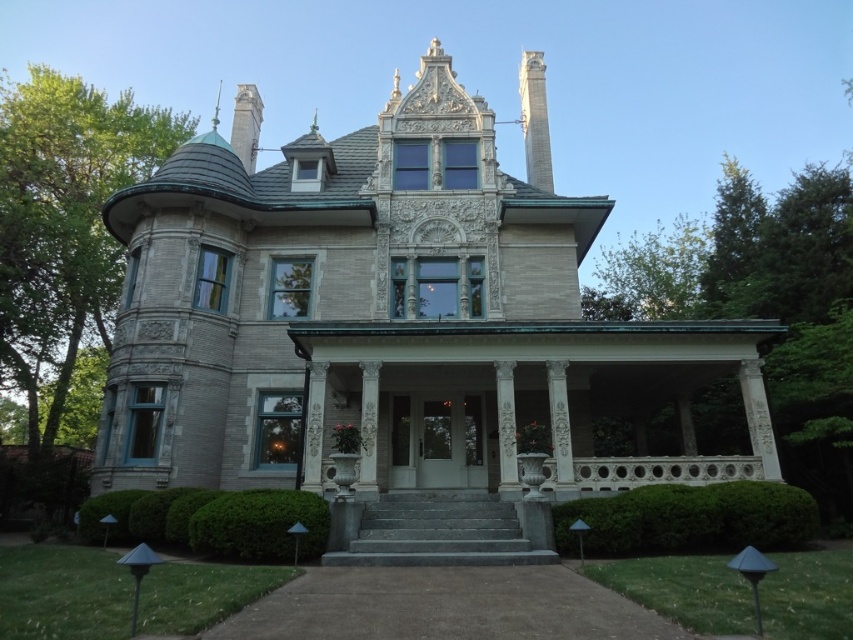
Question: Can you confirm if stone mansion at center is positioned to the right of gray stone steps at center?

Choices:
 (A) yes
 (B) no

Answer: (B)

Question: Is green leafy hedge at lower center further to camera compared to green leafy hedge at lower left?

Choices:
 (A) yes
 (B) no

Answer: (A)

Question: Can you confirm if green leafy hedge at lower left is thinner than gray stone steps at center?

Choices:
 (A) no
 (B) yes

Answer: (B)

Question: Which of the following is the closest to the observer?

Choices:
 (A) (788, 541)
 (B) (469, 506)
 (C) (270, 541)

Answer: (C)

Question: Which point is closer to the camera?

Choices:
 (A) green leafy hedge at lower center
 (B) stone mansion at center
 (C) gray stone steps at center

Answer: (C)

Question: Which of these objects is positioned farthest from the green leafy hedge at lower left?

Choices:
 (A) green leafy hedge at lower center
 (B) gray stone steps at center

Answer: (A)